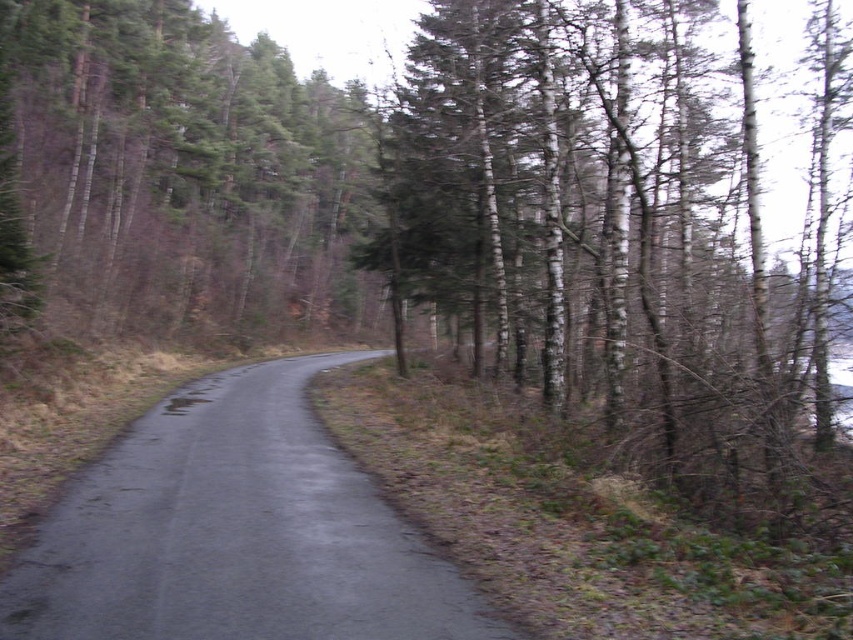
You are driving a car and see two points on the road ahead. The first point is at coordinates point (819, 134) and the second is at point (126, 440). Which point is closer to your current position?

Point (126, 440) is closer to your current position because it is in front of point (819, 134), which is further back along the road.

You are driving a car that is 2 meters wide. You come across a narrow road in a forest. The road is flanked by smooth white bark trees at right and black asphalt road at center. Can your car safely pass through without hitting the trees?

The smooth white bark trees at right has a larger size compared to black asphalt road at center. Therefore, the road may not be wide enough for a 2m car to pass safely without hitting the trees.